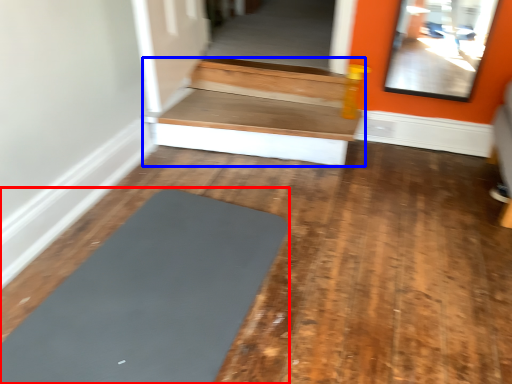
Question: Which of the following is the farthest to the observer, yoga (highlighted by a red box) or stairwell (highlighted by a blue box)?

Choices:
 (A) yoga
 (B) stairwell

Answer: (B)